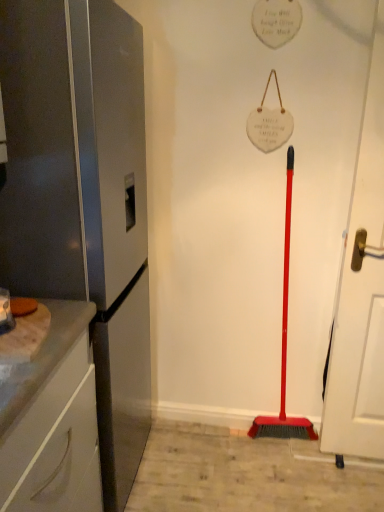
Question: From a real-world perspective, is white matte door at right positioned above or below white glossy cabinet at left?

Choices:
 (A) below
 (B) above

Answer: (B)

Question: Is white matte door at right taller or shorter than white glossy cabinet at left?

Choices:
 (A) short
 (B) tall

Answer: (B)

Question: Which of these objects is positioned closest to the white glossy cabinet at left?

Choices:
 (A) satin silver refrigerator at left
 (B) white matte door at right

Answer: (A)

Question: Which object is the closest to the white matte door at right?

Choices:
 (A) satin silver refrigerator at left
 (B) white glossy cabinet at left

Answer: (A)